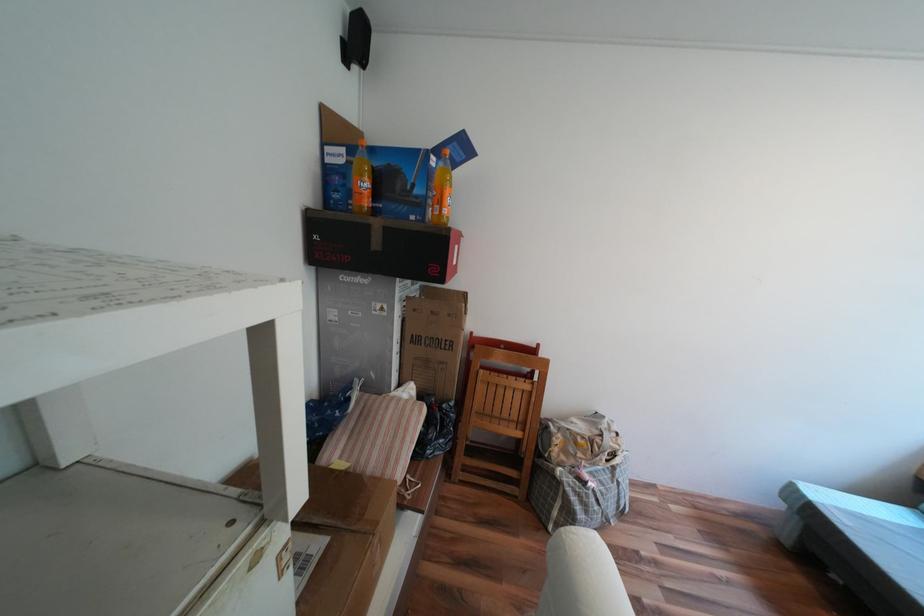
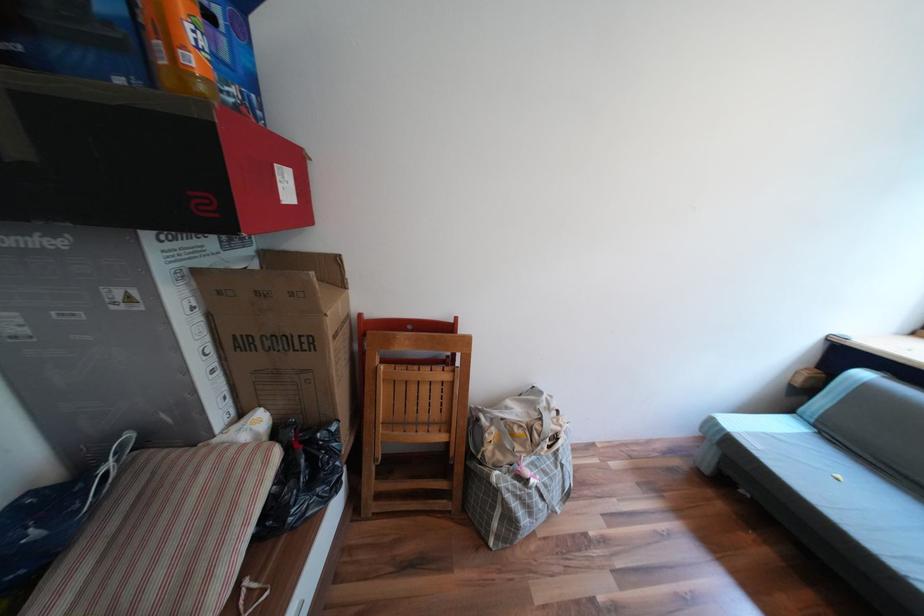
The point at (x=408, y=341) is marked in the first image. Where is the corresponding point in the second image?

(219, 349)